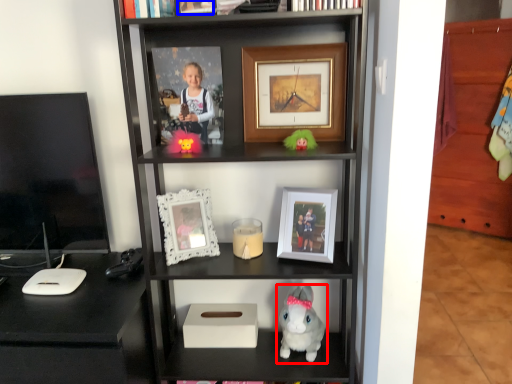
Question: Which object appears closest to the camera in this image, toy (highlighted by a red box) or picture frame (highlighted by a blue box)?

Choices:
 (A) toy
 (B) picture frame

Answer: (B)